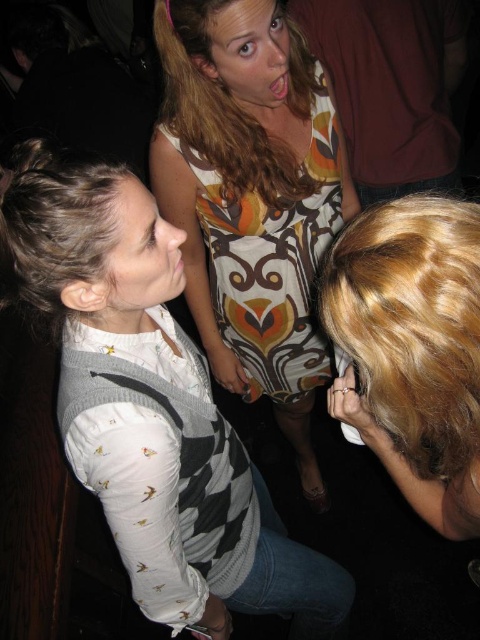
Between white textured sweater at center and blonde wavy hair at lower right, which one has more height?

With more height is white textured sweater at center.

Can you confirm if white textured sweater at center is wider than blonde wavy hair at lower right?

Indeed, white textured sweater at center has a greater width compared to blonde wavy hair at lower right.

Between point (108, 448) and point (478, 412), which one is positioned behind?

Positioned behind is point (108, 448).

Identify the location of white textured sweater at center. (222, 509).

Which is more to the left, white textured sweater at center or blonde wavy hair at upper center?

Positioned to the left is white textured sweater at center.

Does point (244, 573) lie behind point (268, 145)?

No, it is not.

I want to click on white textured sweater at center, so click(x=222, y=509).

Who is positioned more to the left, blonde wavy hair at lower right or dark brown textured hair at left?

From the viewer's perspective, dark brown textured hair at left appears more on the left side.

Can you confirm if blonde wavy hair at lower right is positioned below dark brown textured hair at left?

Yes, blonde wavy hair at lower right is below dark brown textured hair at left.

Locate an element on the screen. blonde wavy hair at lower right is located at coordinates (412, 323).

Locate an element on the screen. The width and height of the screenshot is (480, 640). blonde wavy hair at lower right is located at coordinates (412, 323).